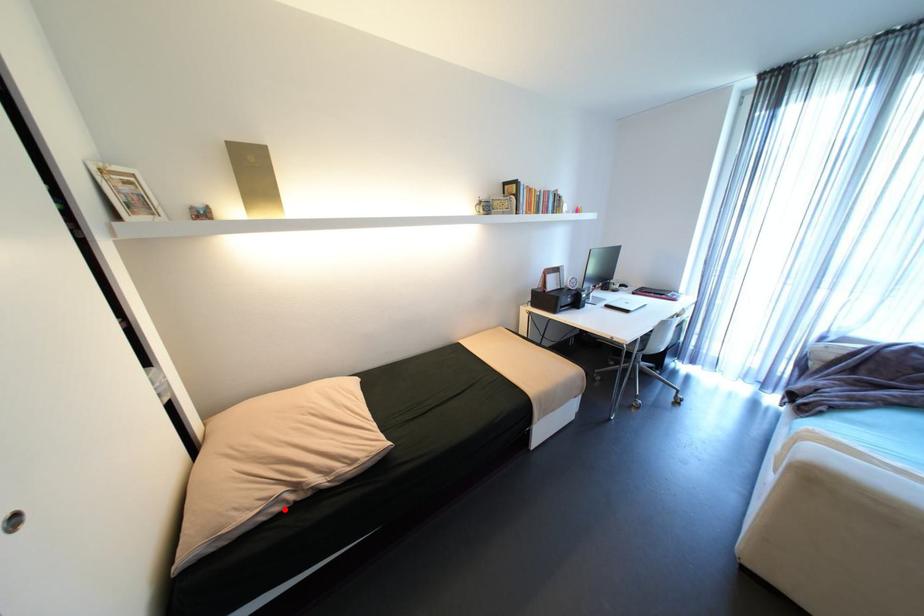
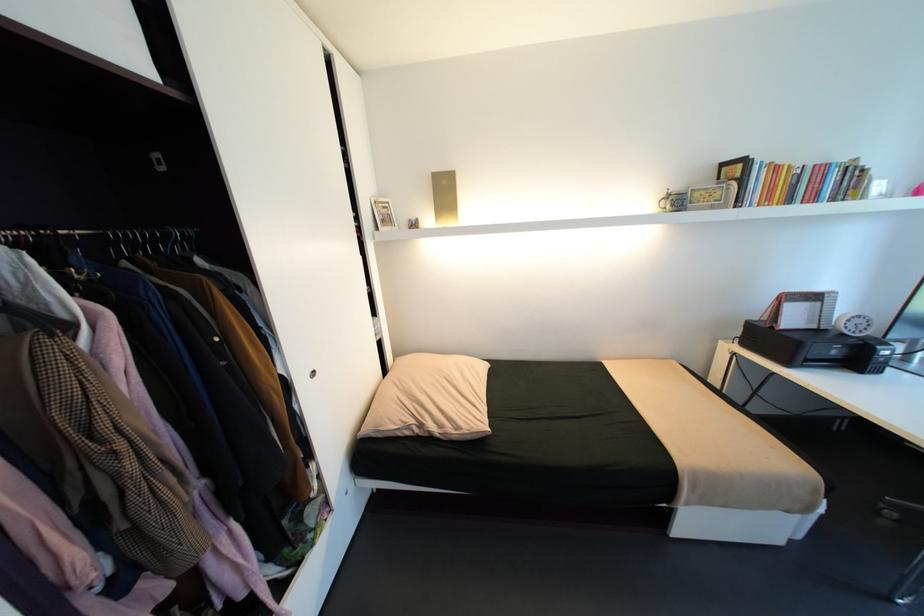
Where in the second image is the point corresponding to the highlighted location from the first image?

(415, 432)